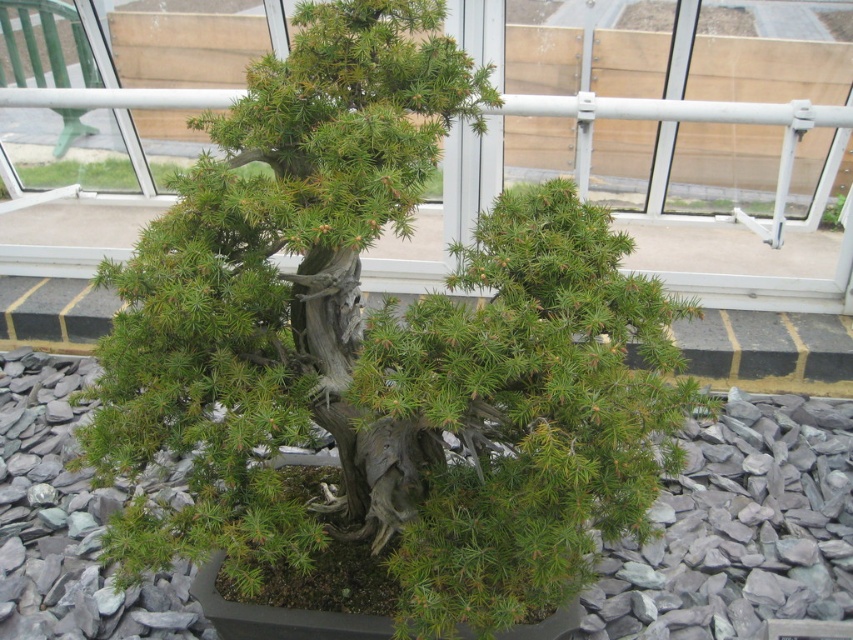
Question: Is gray gravel at center to the right of green textured plant at center from the viewer's perspective?

Choices:
 (A) no
 (B) yes

Answer: (A)

Question: Does gray gravel at center come in front of green textured plant at center?

Choices:
 (A) no
 (B) yes

Answer: (B)

Question: Which point is farther from the camera taking this photo?

Choices:
 (A) (140, 620)
 (B) (842, 198)

Answer: (B)

Question: Does gray gravel at center appear under green textured plant at center?

Choices:
 (A) no
 (B) yes

Answer: (B)

Question: Among these objects, which one is nearest to the camera?

Choices:
 (A) gray gravel at center
 (B) green textured plant at center

Answer: (A)